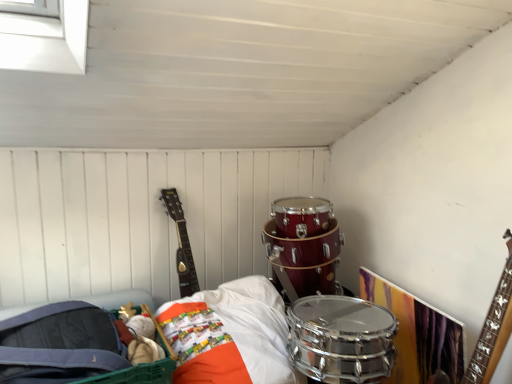
Question: Is matte black guitar at upper left wider or thinner than shiny silver drum at lower center?

Choices:
 (A) thin
 (B) wide

Answer: (A)

Question: Considering the positions of matte black guitar at upper left and shiny silver drum at lower center in the image, is matte black guitar at upper left taller or shorter than shiny silver drum at lower center?

Choices:
 (A) short
 (B) tall

Answer: (B)

Question: From the image's perspective, is matte black guitar at upper left positioned above or below shiny silver drum at lower center?

Choices:
 (A) below
 (B) above

Answer: (B)

Question: In the image, is shiny silver drum at lower center positioned in front of or behind matte black guitar at upper left?

Choices:
 (A) behind
 (B) front

Answer: (B)

Question: Considering the positions of shiny silver drum at lower center and matte black guitar at upper left in the image, is shiny silver drum at lower center taller or shorter than matte black guitar at upper left?

Choices:
 (A) tall
 (B) short

Answer: (B)

Question: Considering the positions of shiny silver drum at lower center and matte black guitar at upper left in the image, is shiny silver drum at lower center bigger or smaller than matte black guitar at upper left?

Choices:
 (A) small
 (B) big

Answer: (B)

Question: From the image's perspective, is shiny silver drum at lower center located above or below matte black guitar at upper left?

Choices:
 (A) below
 (B) above

Answer: (A)